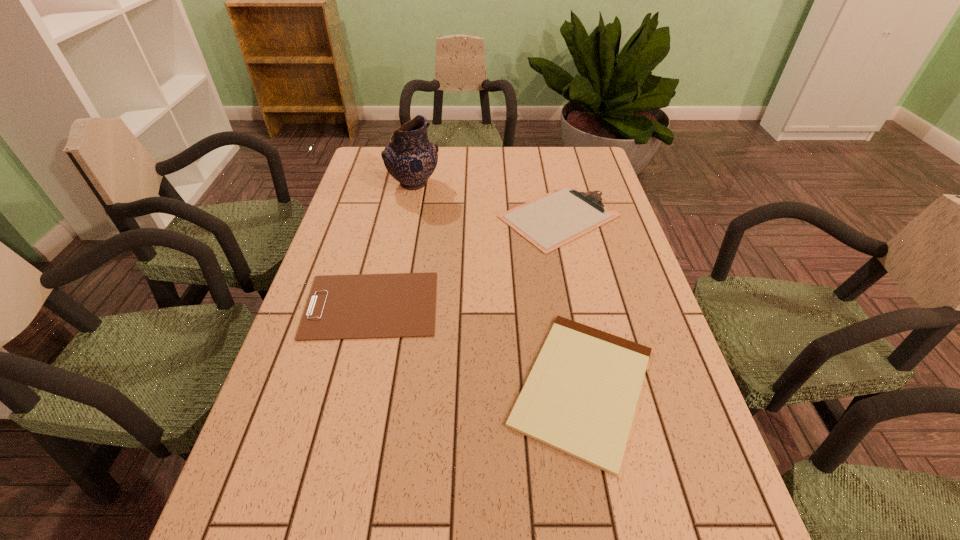
You are a GUI agent. You are given a task and a screenshot of the screen. Output one action in this format:
    pyautogui.click(x=<x>, y=<y>)
    Task: Click on the object positioned at the far edge
    
    Given the screenshot: What is the action you would take?
    tap(410, 157)

At what (x,y) coordinates should I click in order to perform the action: click on pottery present at the left edge. Please return your answer as a coordinate pair (x, y). Image resolution: width=960 pixels, height=540 pixels. Looking at the image, I should click on (410, 157).

Find the location of `clipboard that is positioned at the left edge`. clipboard that is positioned at the left edge is located at coordinates (366, 306).

Where is `object at the far left corner`? The image size is (960, 540). object at the far left corner is located at coordinates (410, 157).

At what (x,y) coordinates should I click in order to perform the action: click on vacant region at the far edge. Please return your answer as a coordinate pair (x, y). The height and width of the screenshot is (540, 960). Looking at the image, I should click on click(x=487, y=172).

This screenshot has width=960, height=540. In the image, there is a desktop. What are the coordinates of `free region at the left edge` in the screenshot? It's located at (314, 516).

At what (x,y) coordinates should I click in order to perform the action: click on free region at the right edge. Please return your answer as a coordinate pair (x, y). Looking at the image, I should click on (729, 528).

You are a GUI agent. You are given a task and a screenshot of the screen. Output one action in this format:
    pyautogui.click(x=<x>, y=<y>)
    Task: Click on the vacant point at the far right corner
    
    Given the screenshot: What is the action you would take?
    pyautogui.click(x=591, y=170)

Locate an element on the screen. This screenshot has height=540, width=960. vacant space that's between the shortest clipboard and the farthest clipboard is located at coordinates (571, 301).

Locate an element on the screen. free space between the second shortest clipboard and the shortest clipboard is located at coordinates (477, 346).